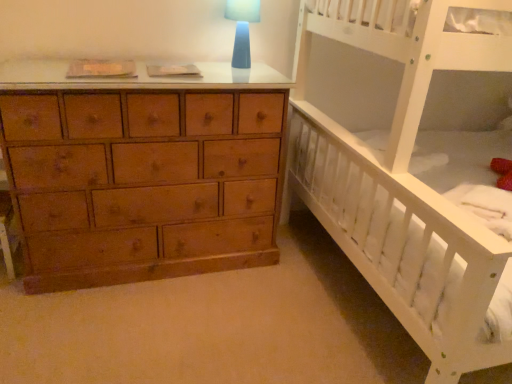
Question: Is point (225, 3) closer or farther from the camera than point (480, 36)?

Choices:
 (A) farther
 (B) closer

Answer: (A)

Question: Looking at their shapes, would you say blue glass lampshade at upper center is wider or thinner than white wooden bunk bed at right?

Choices:
 (A) thin
 (B) wide

Answer: (A)

Question: Visually, is blue glass lampshade at upper center positioned to the left or to the right of white wooden bunk bed at right?

Choices:
 (A) left
 (B) right

Answer: (A)

Question: Is point (463, 86) positioned closer to the camera than point (244, 21)?

Choices:
 (A) farther
 (B) closer

Answer: (A)

Question: Considering the relative positions of white wooden bunk bed at right and blue glass lampshade at upper center in the image provided, is white wooden bunk bed at right to the left or to the right of blue glass lampshade at upper center?

Choices:
 (A) right
 (B) left

Answer: (A)

Question: Is white wooden bunk bed at right taller or shorter than blue glass lampshade at upper center?

Choices:
 (A) short
 (B) tall

Answer: (B)

Question: In the image, is white wooden bunk bed at right positioned in front of or behind blue glass lampshade at upper center?

Choices:
 (A) front
 (B) behind

Answer: (A)